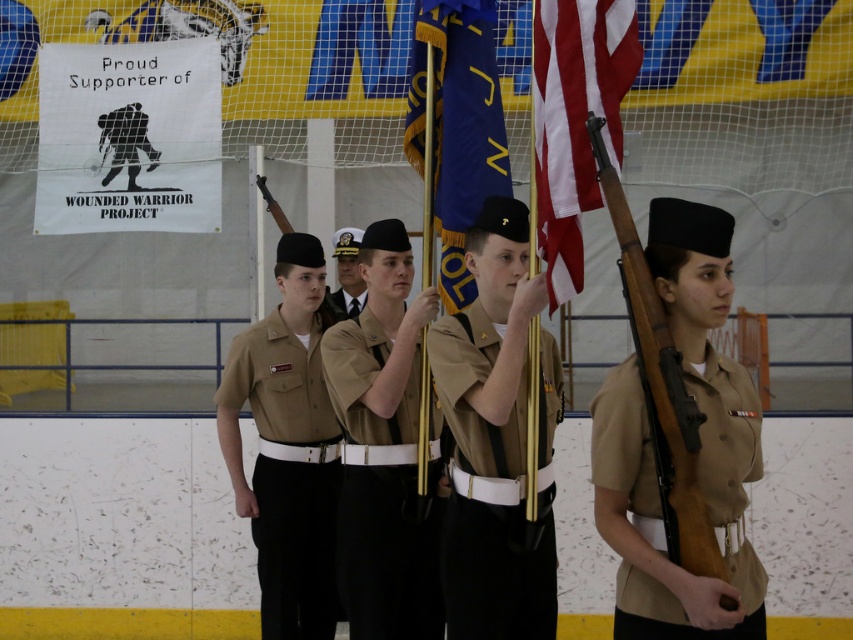
Question: Which point is closer to the camera?

Choices:
 (A) satin black tie at center
 (B) tan fabric uniform at right

Answer: (B)

Question: Is matte khaki uniform at center above satin black tie at center?

Choices:
 (A) no
 (B) yes

Answer: (A)

Question: Which is farther from the tan/khaki fabric uniform at center?

Choices:
 (A) tan fabric uniform at right
 (B) american flag at center
 (C) brown cotton uniform at center
 (D) blue fabric flag at center

Answer: (A)

Question: Does brown cotton uniform at center have a smaller size compared to tan fabric uniform at right?

Choices:
 (A) yes
 (B) no

Answer: (A)

Question: Is tan/khaki fabric uniform at center below tan fabric uniform at right?

Choices:
 (A) no
 (B) yes

Answer: (B)

Question: Which is nearer to the american flag at center?

Choices:
 (A) tan fabric uniform at right
 (B) khaki uniform at center
 (C) satin black tie at center
 (D) blue fabric flag at center

Answer: (D)